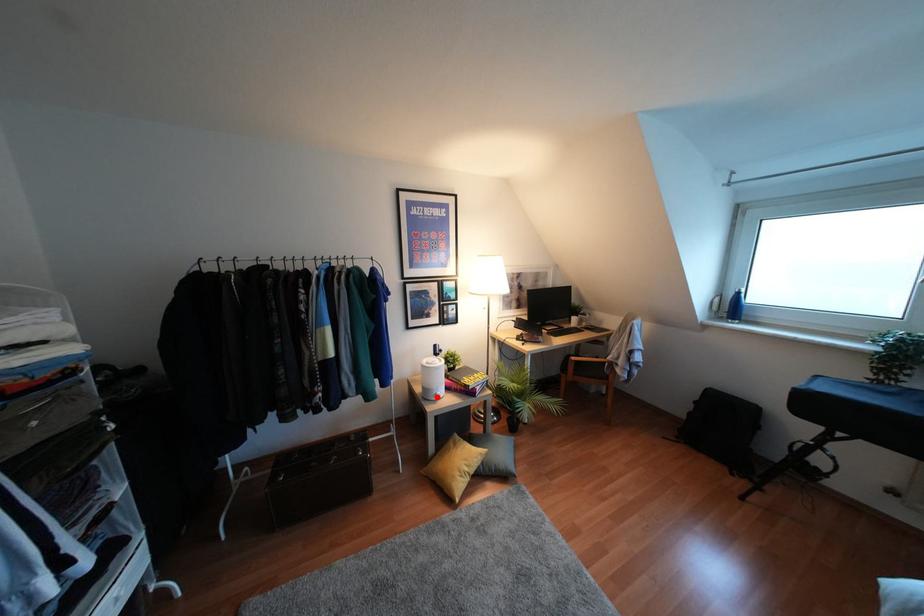
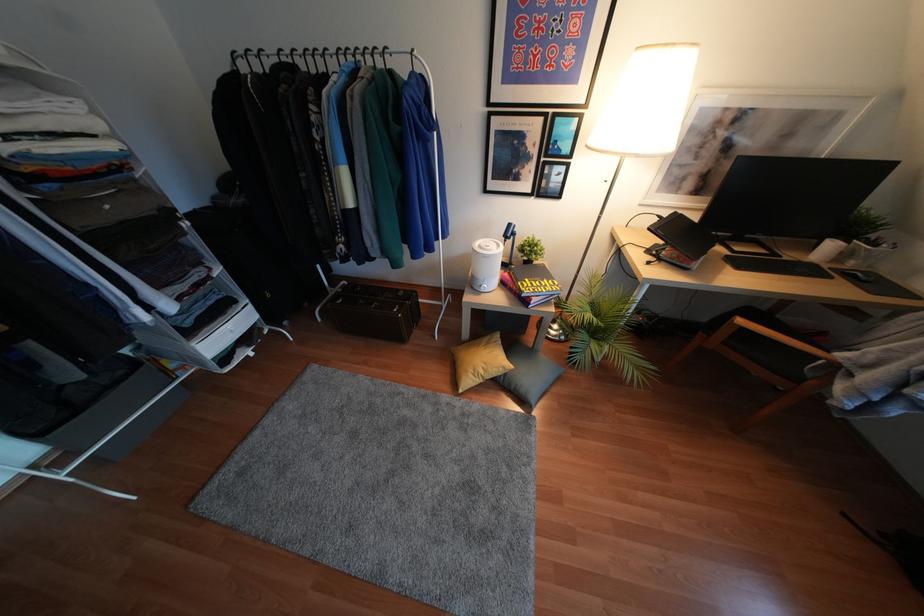
Where in the second image is the point corresponding to the highlighted location from the first image?

(481, 290)